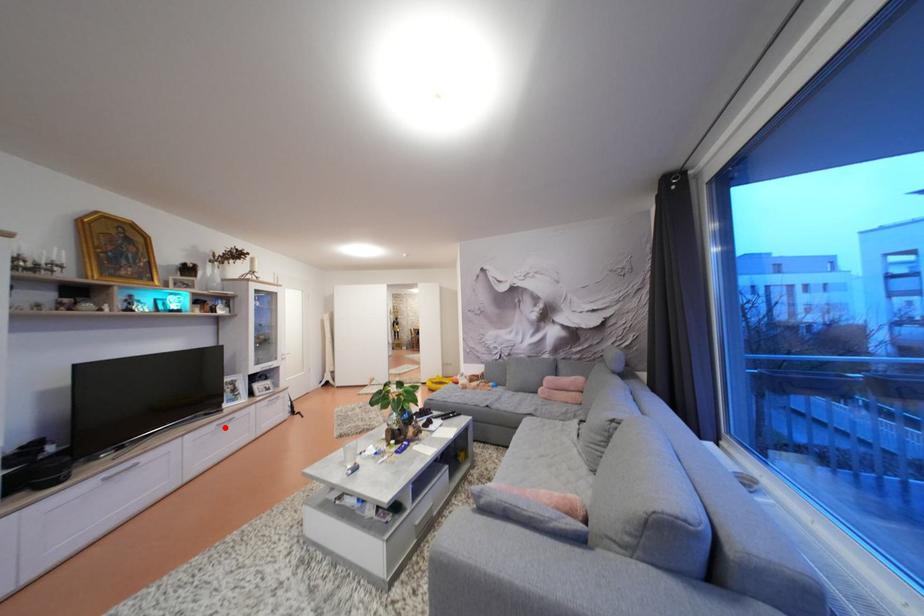
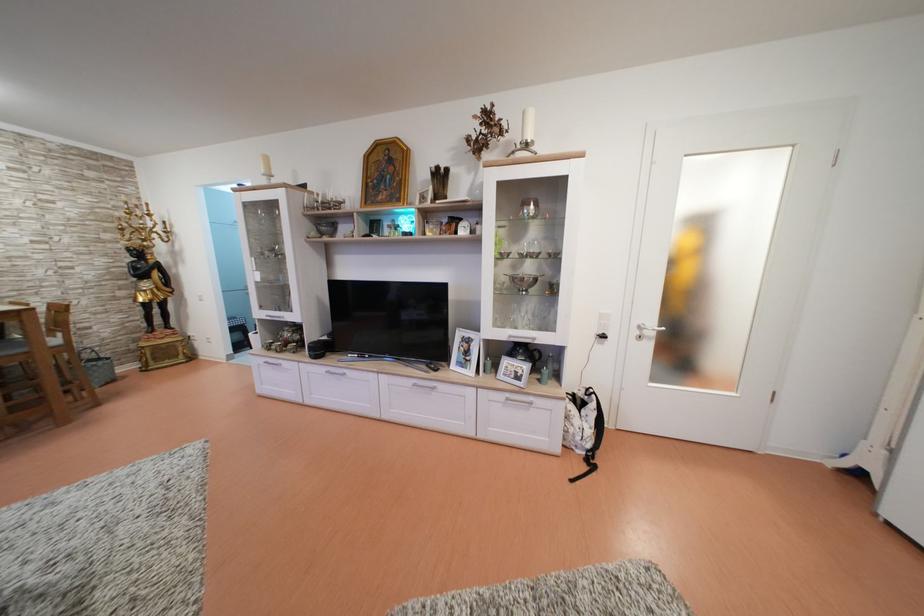
Locate, in the second image, the point that corresponds to the highlighted location in the first image.

(422, 387)